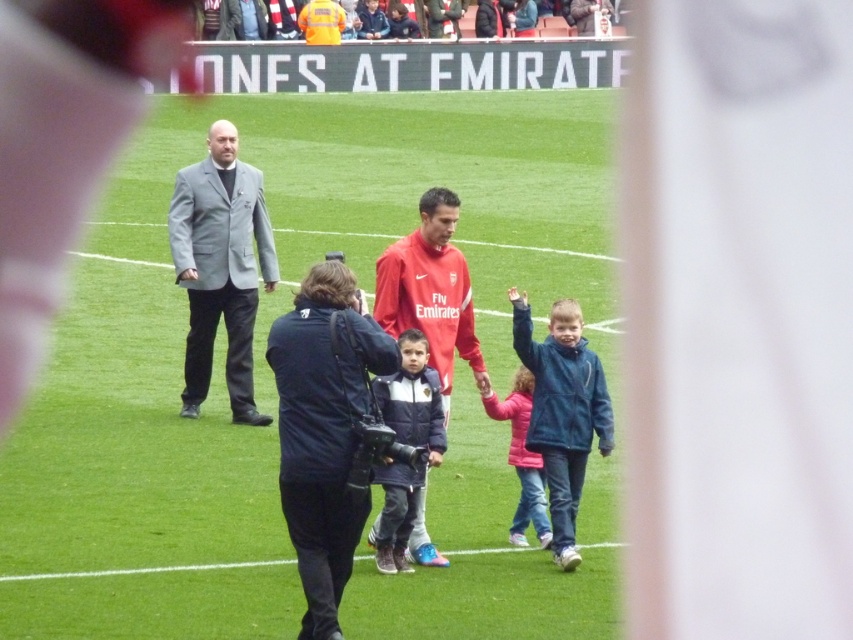
Based on the photo, who is positioned more to the left, green grass field at center or blue fleece jacket at center?

green grass field at center

Which is behind, point (363, 275) or point (553, 552)?

The point (363, 275) is behind.

Where is `green grass field at center`? green grass field at center is located at coordinates (264, 340).

Is black fabric camera at center wider than blue fleece jacket at center?

Correct, the width of black fabric camera at center exceeds that of blue fleece jacket at center.

Can you confirm if black fabric camera at center is positioned to the right of blue fleece jacket at center?

Incorrect, black fabric camera at center is not on the right side of blue fleece jacket at center.

Does point (326, 476) lie in front of point (556, 369)?

Yes, it is.

Where is `black fabric camera at center`? This screenshot has height=640, width=853. black fabric camera at center is located at coordinates coord(323,429).

Can you confirm if green grass field at center is positioned above black fabric camera at center?

Yes, green grass field at center is above black fabric camera at center.

Between green grass field at center and black fabric camera at center, which one appears on the right side from the viewer's perspective?

Positioned to the right is green grass field at center.

The width and height of the screenshot is (853, 640). What are the coordinates of `green grass field at center` in the screenshot? It's located at (264, 340).